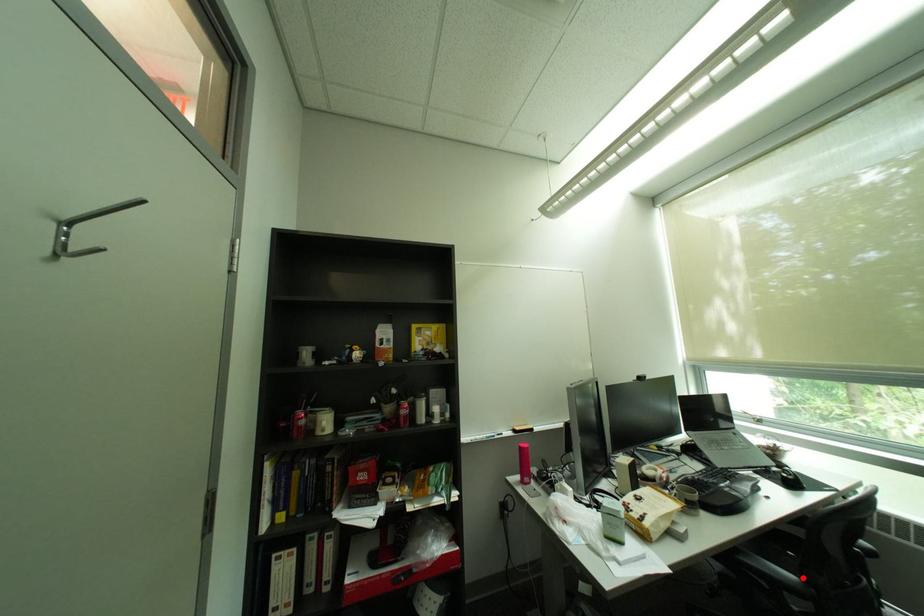
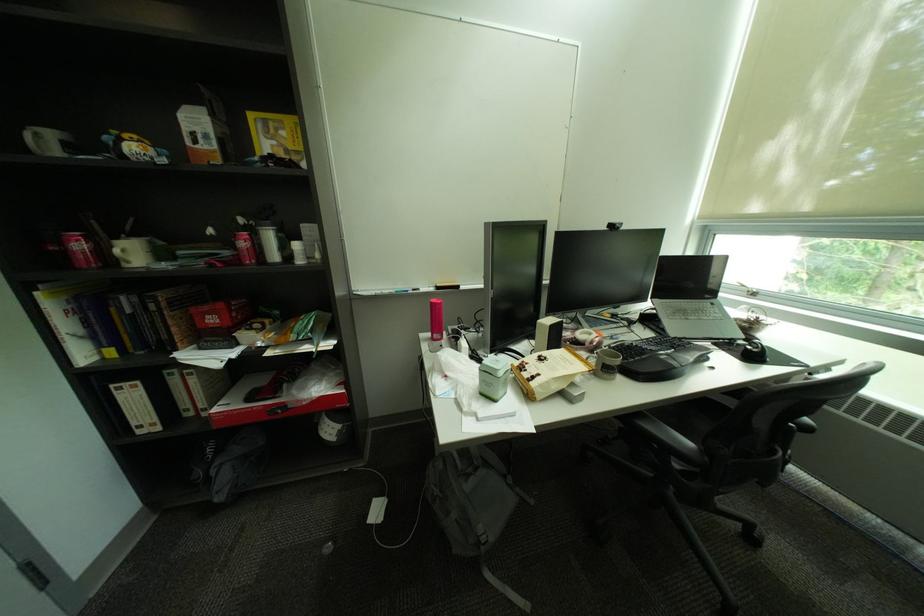
Where in the second image is the point corresponding to the highlighted location from the first image?

(700, 445)